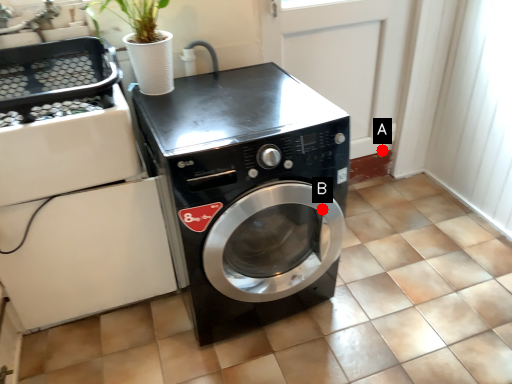
Question: Two points are circled on the image, labeled by A and B beside each circle. Which point is farther from the camera taking this photo?

Choices:
 (A) A is further
 (B) B is further

Answer: (A)